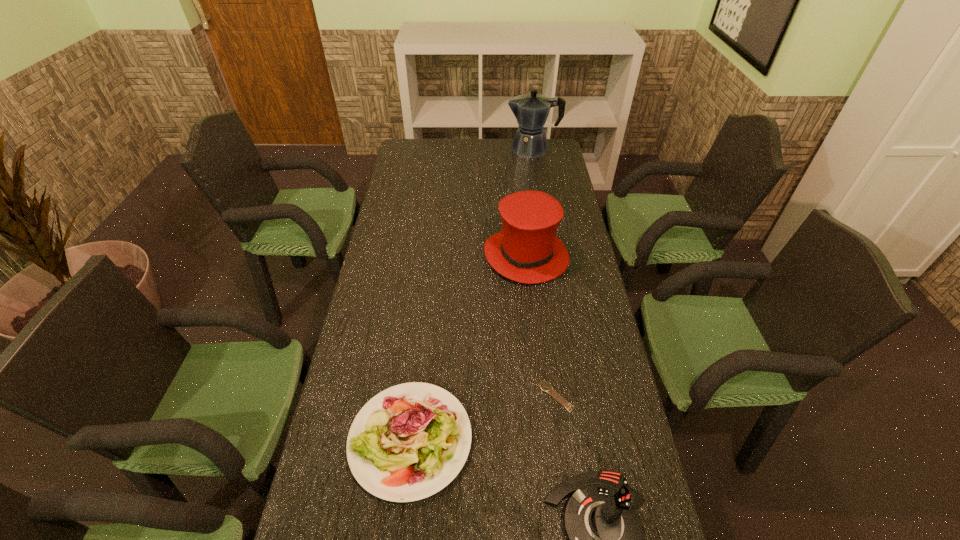
Identify the location of free location that satisfies the following two spatial constraints: 1. on the back side of the watch; 2. on the left side of the fourth tallest object. This screenshot has height=540, width=960. (416, 396).

The image size is (960, 540). What are the coordinates of `vacant space that satisfies the following two spatial constraints: 1. on the back side of the salad plate; 2. on the right side of the hat` in the screenshot? It's located at (432, 255).